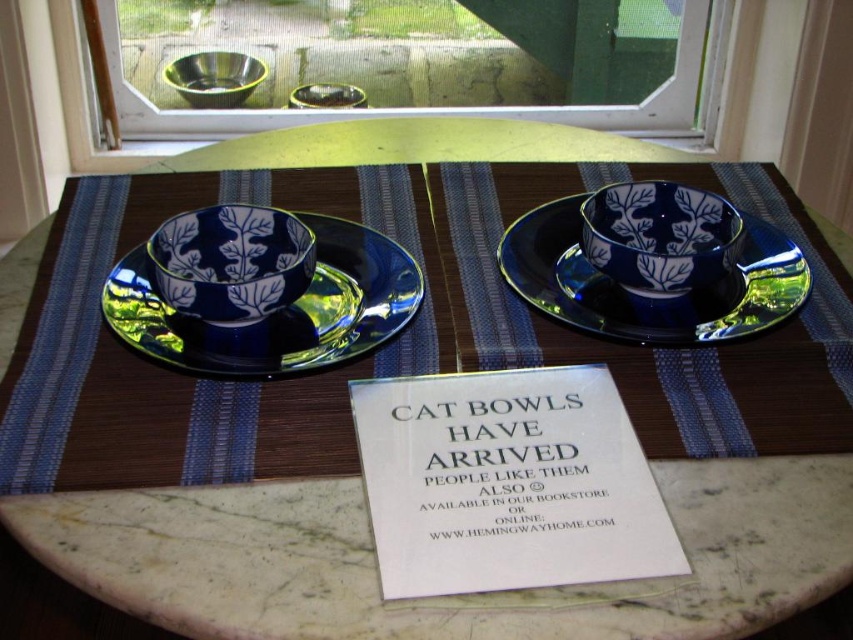
Which is more to the left, blue glass plate at center or blue glossy teacup at center?

Positioned to the left is blue glossy teacup at center.

Between point (737, 289) and point (229, 266), which one is positioned behind?

Positioned behind is point (737, 289).

Where is `blue glass plate at center`? The height and width of the screenshot is (640, 853). blue glass plate at center is located at coordinates (642, 298).

Does blue glossy teacup at center have a greater height compared to metallic bowls at upper center?

No, blue glossy teacup at center is not taller than metallic bowls at upper center.

Can you confirm if blue glossy teacup at center is positioned above metallic bowls at upper center?

Incorrect, blue glossy teacup at center is not positioned above metallic bowls at upper center.

At what (x,y) coordinates should I click in order to perform the action: click on blue glossy teacup at center. Please return your answer as a coordinate pair (x, y). Looking at the image, I should click on (231, 260).

Is blue glass plate at center to the left of blue glossy teacup at center right from the viewer's perspective?

In fact, blue glass plate at center is to the right of blue glossy teacup at center right.

Does blue glass plate at center have a greater height compared to blue glossy teacup at center right?

Yes.

The width and height of the screenshot is (853, 640). Find the location of `blue glass plate at center`. blue glass plate at center is located at coordinates (642, 298).